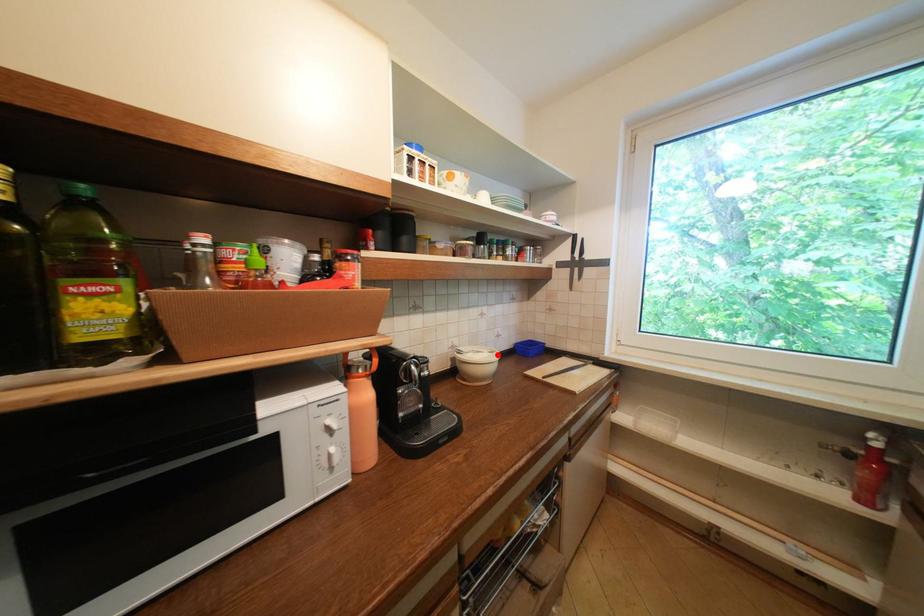
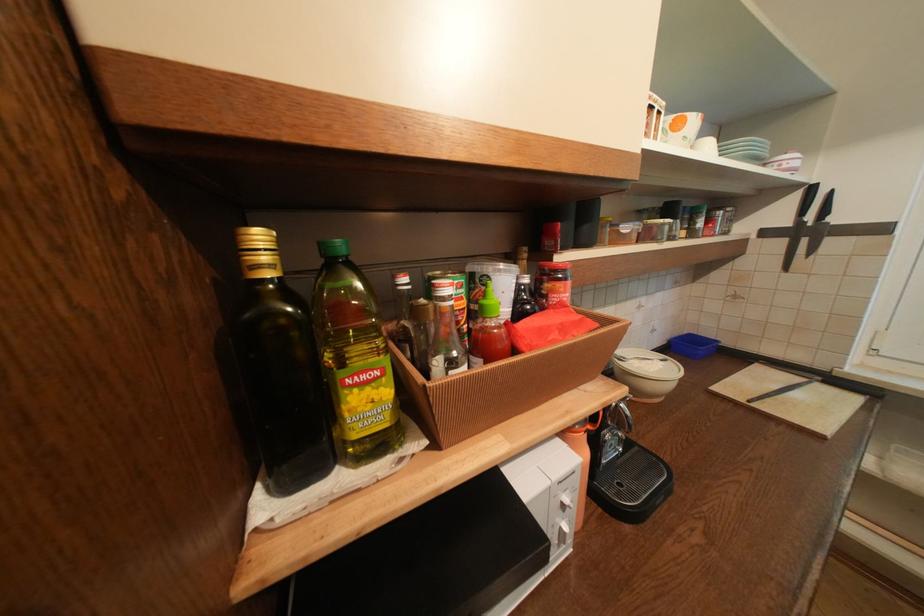
Find the pixel in the second image that matches the highlighted location in the first image.

(670, 363)